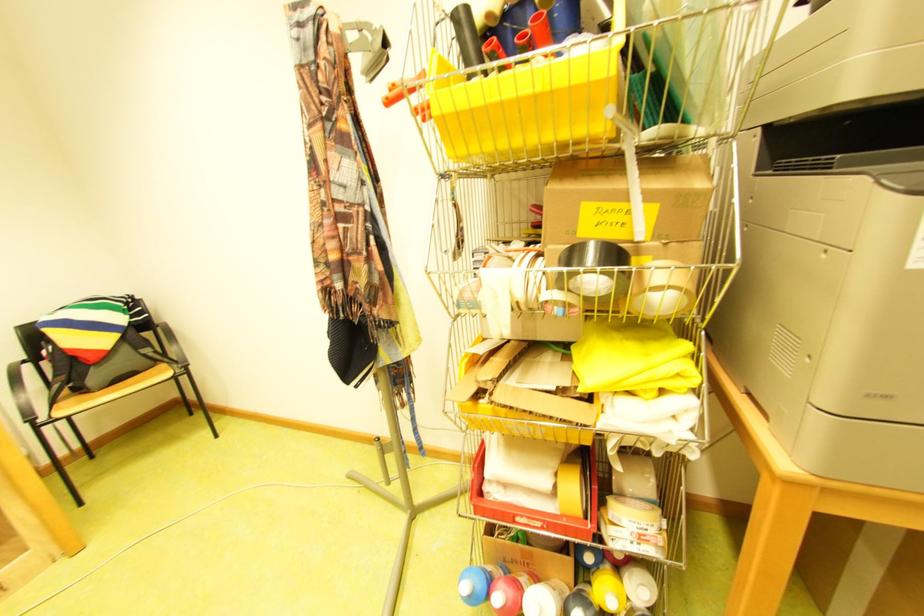
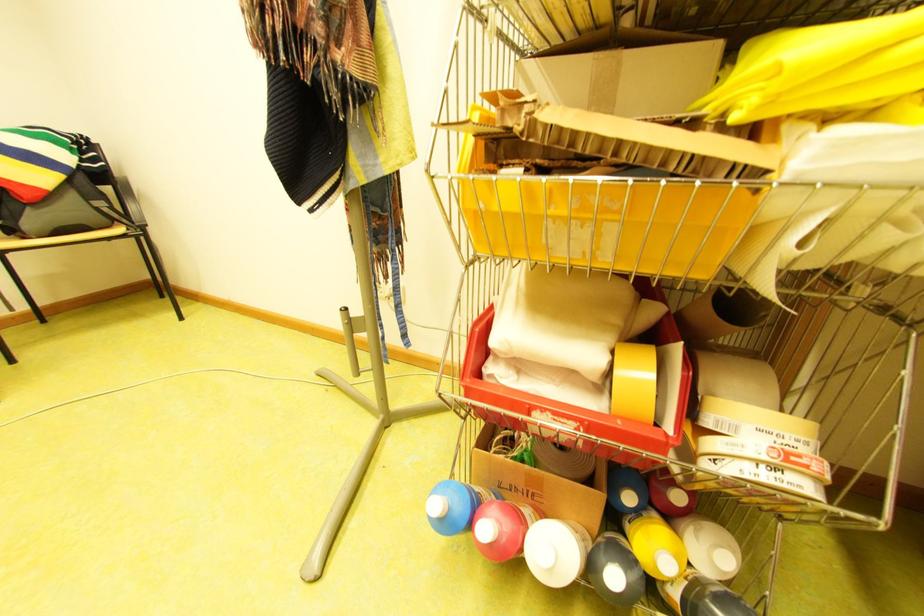
Question: The first image is from the beginning of the video and the second image is from the end. How did the camera likely rotate when shooting the video?

Choices:
 (A) Left
 (B) Right
 (C) Up
 (D) Down

Answer: (D)